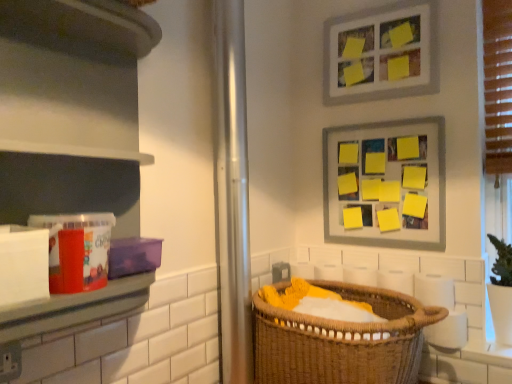
Question: From a real-world perspective, is brown woven basket at lower center above or below matte plastic container at left?

Choices:
 (A) above
 (B) below

Answer: (B)

Question: In the image, is brown woven basket at lower center positioned in front of or behind matte plastic container at left?

Choices:
 (A) front
 (B) behind

Answer: (B)

Question: Based on their relative distances, which object is farther from the matte plastic container at left?

Choices:
 (A) yellow paper/magnetic board at upper right, which is the 1th picture frame from bottom to top
 (B) metallic silver screen door at center
 (C) matte gray picture frame at upper center, which is counted as the second picture frame, starting from the bottom
 (D) brown woven basket at lower center

Answer: (C)

Question: Estimate the real-world distances between objects in this image. Which object is closer to the yellow paper/magnetic board at upper right, which is the 1th picture frame from bottom to top?

Choices:
 (A) matte gray picture frame at upper center, which is the 1th picture frame in top-to-bottom order
 (B) matte plastic container at left
 (C) brown woven basket at lower center
 (D) metallic silver screen door at center

Answer: (A)